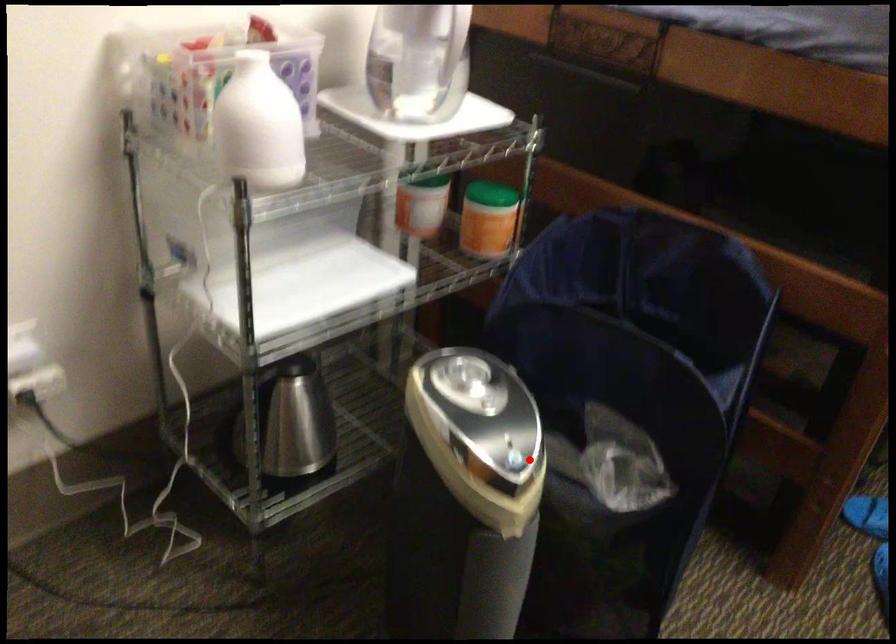
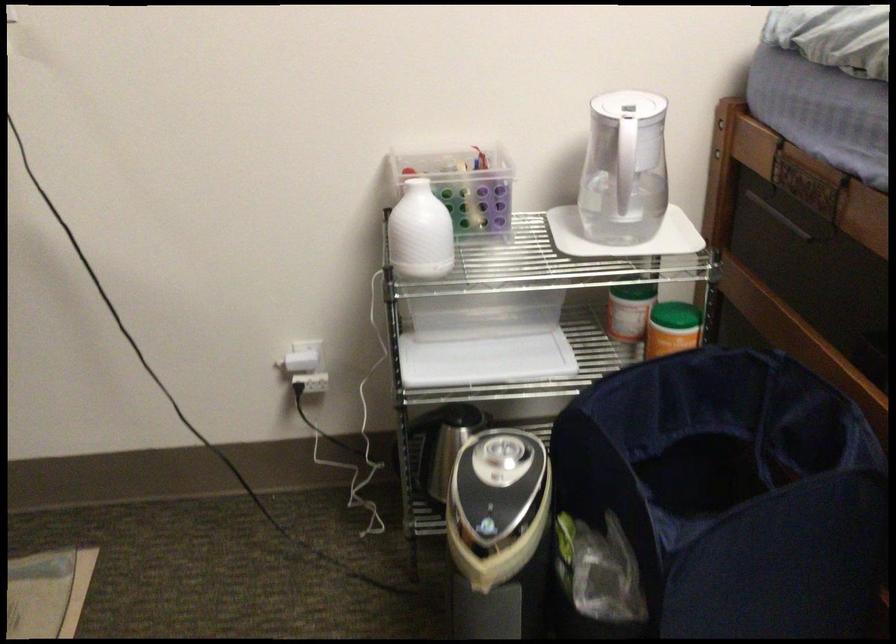
The point at the highlighted location is marked in the first image. Where is the corresponding point in the second image?

(498, 534)